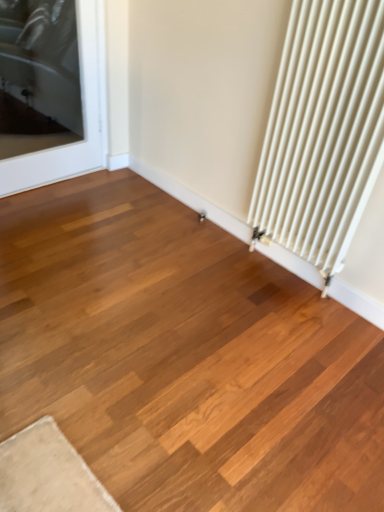
Locate an element on the screen. vacant region under white matte radiator at right (from a real-world perspective) is located at coordinates (286, 272).